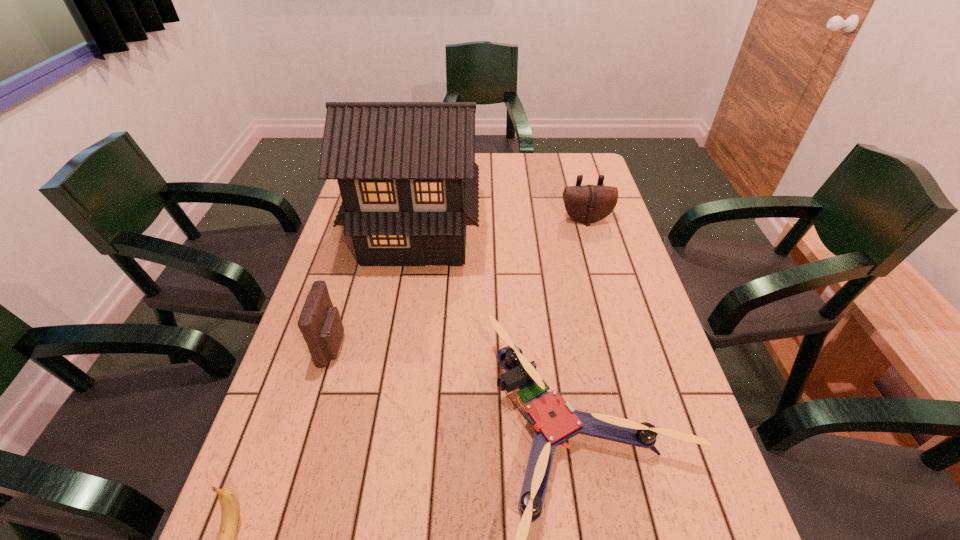
In the image, there is a desktop. What are the coordinates of `free region at the left edge` in the screenshot? It's located at (282, 384).

Where is `vacant area at the right edge of the desktop`? The width and height of the screenshot is (960, 540). vacant area at the right edge of the desktop is located at coordinates (660, 378).

At what (x,y) coordinates should I click in order to perform the action: click on vacant area that lies between the farther pouch and the tallest object. Please return your answer as a coordinate pair (x, y). This screenshot has height=540, width=960. Looking at the image, I should click on (501, 226).

Identify the location of vacant area that lies between the tallest object and the farther pouch. (501, 226).

Identify the location of free space between the farther pouch and the tallest object. click(x=501, y=226).

Locate an element on the screen. object that ranks as the fourth closest to the shortest object is located at coordinates (590, 203).

This screenshot has width=960, height=540. What are the coordinates of `the closest object to the dollhouse` in the screenshot? It's located at (320, 323).

Locate an element on the screen. The width and height of the screenshot is (960, 540). vacant space that satisfies the following two spatial constraints: 1. with the flap open on the farther pouch; 2. with an open flap on the left pouch is located at coordinates (622, 347).

You are a GUI agent. You are given a task and a screenshot of the screen. Output one action in this format:
    pyautogui.click(x=<x>, y=<y>)
    Task: Click on the free region that satisfies the following two spatial constraints: 1. with the flap open on the right pouch; 2. with an open flap on the nearer pouch
    
    Given the screenshot: What is the action you would take?
    pyautogui.click(x=622, y=347)

You are a GUI agent. You are given a task and a screenshot of the screen. Output one action in this format:
    pyautogui.click(x=<x>, y=<y>)
    Task: Click on the free space that satisfies the following two spatial constraints: 1. on the front-facing side of the dollhouse; 2. with an open flap on the nearer pouch
    Image resolution: width=960 pixels, height=540 pixels.
    Given the screenshot: What is the action you would take?
    pyautogui.click(x=398, y=347)